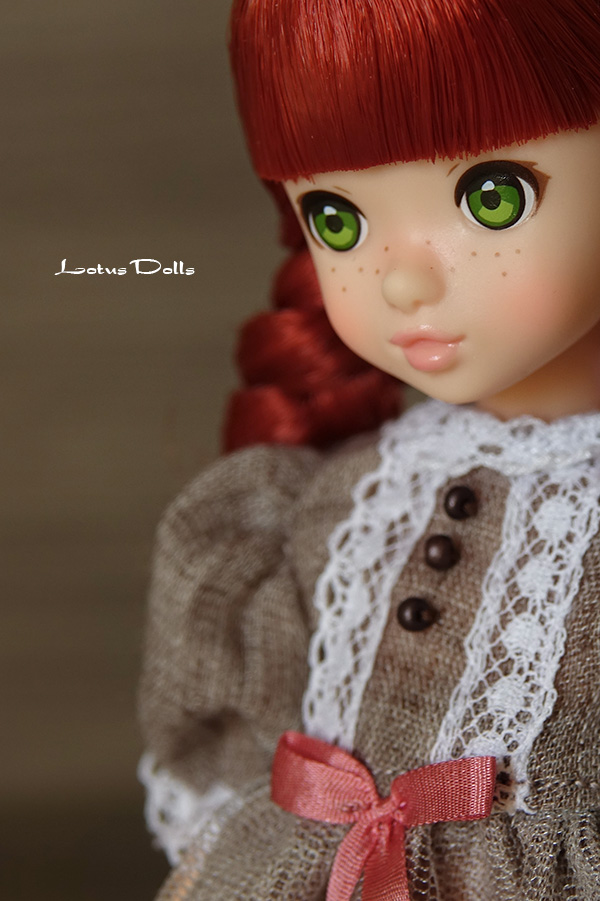
Image resolution: width=600 pixels, height=901 pixels. Find the location of `female doll`. female doll is located at coordinates (519, 454).